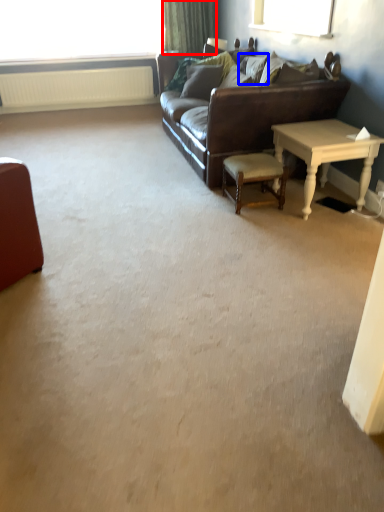
Question: Which object appears farthest to the camera in this image, curtain (highlighted by a red box) or pillow (highlighted by a blue box)?

Choices:
 (A) curtain
 (B) pillow

Answer: (A)